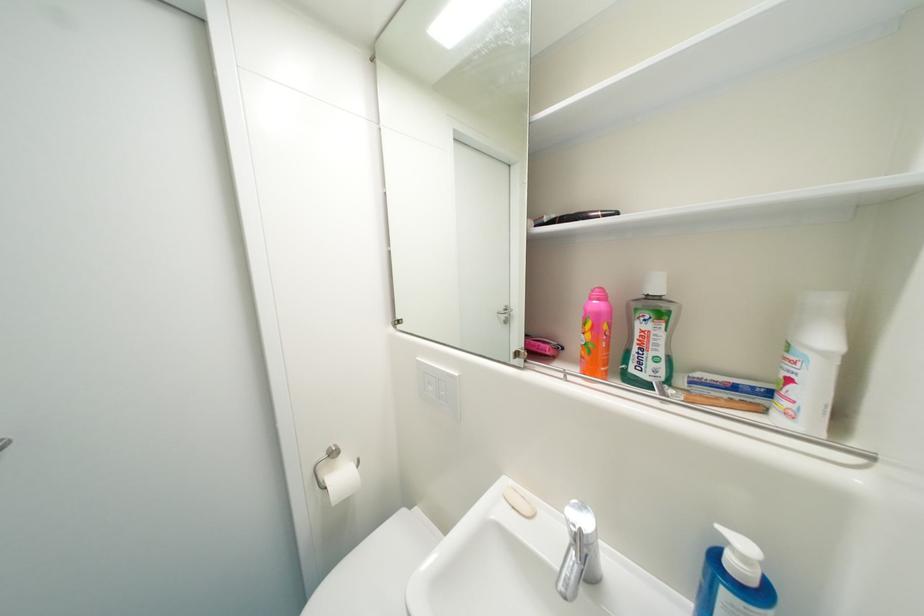
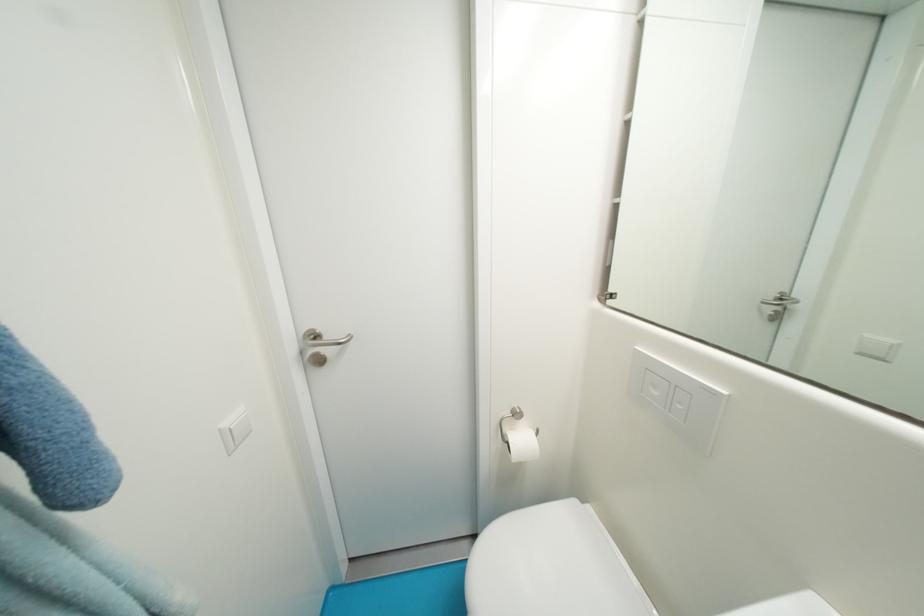
Locate, in the second image, the point that corresponds to pixel 509 318 in the first image.

(777, 312)